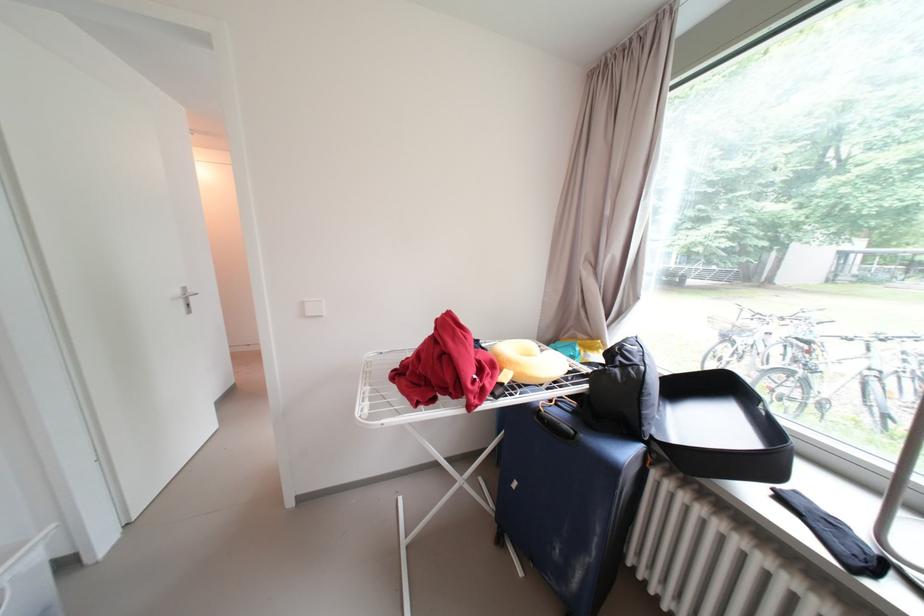
What do you see at coordinates (720, 429) in the screenshot?
I see `the open suitcase lid` at bounding box center [720, 429].